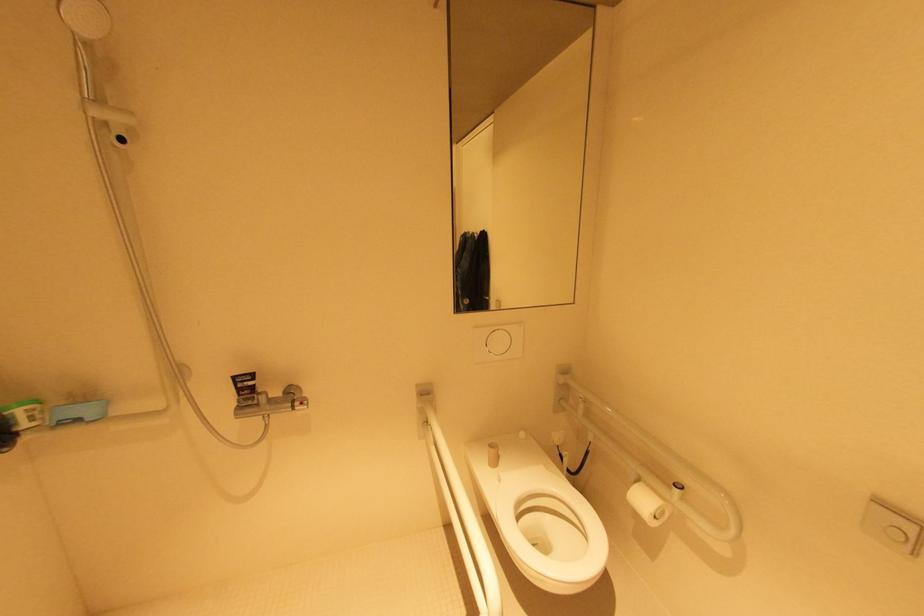
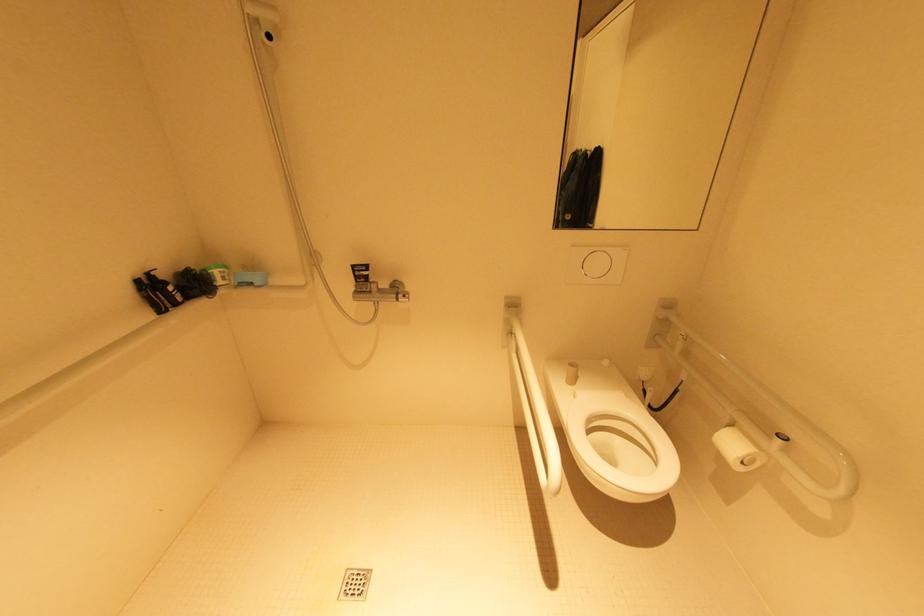
Question: The camera is either moving clockwise (left) or counter-clockwise (right) around the object. The first image is from the beginning of the video and the second image is from the end. Is the camera moving left or right when shooting the video?

Choices:
 (A) Left
 (B) Right

Answer: (B)